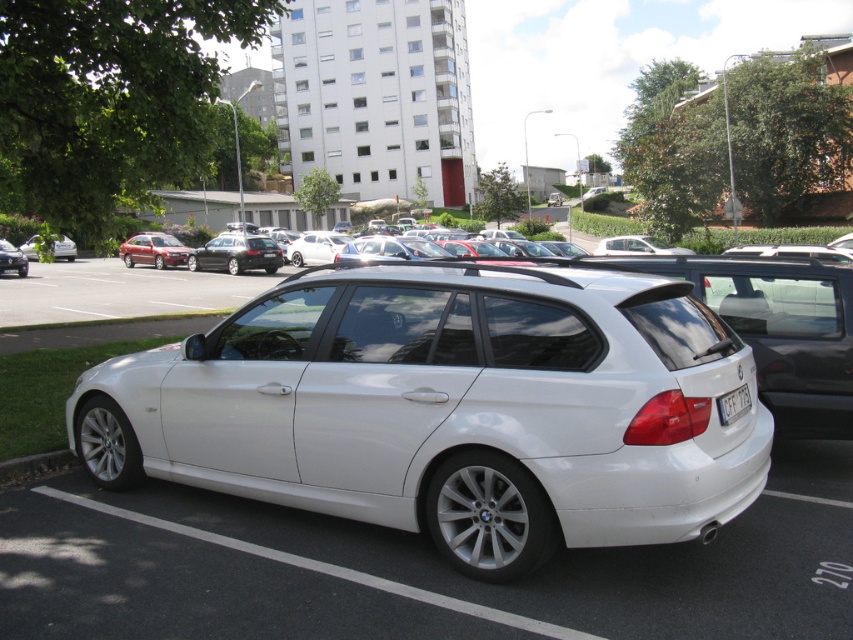
Question: Which object is closer to the camera taking this photo?

Choices:
 (A) white metallic sedan at center
 (B) matte black sedan at left

Answer: (A)

Question: Which point is farther from the camera taking this photo?

Choices:
 (A) (143, 257)
 (B) (219, 268)

Answer: (A)

Question: Does shiny black sedan at center have a larger size compared to metallic red sedan at center?

Choices:
 (A) yes
 (B) no

Answer: (B)

Question: Which point appears closest to the camera in this image?

Choices:
 (A) pyautogui.click(x=621, y=520)
 (B) pyautogui.click(x=227, y=264)

Answer: (A)

Question: Does white metallic sedan at center appear on the left side of black plastic license plate at rear?

Choices:
 (A) no
 (B) yes

Answer: (B)

Question: Can you confirm if black plastic license plate at rear is positioned to the left of matte black sedan at left?

Choices:
 (A) no
 (B) yes

Answer: (A)